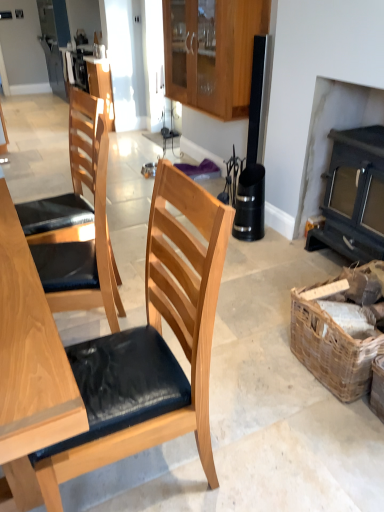
You are a GUI agent. You are given a task and a screenshot of the screen. Output one action in this format:
    pyautogui.click(x=<x>, y=<y>)
    Task: Click on the vacant space in wooden chair with cushion at center, the 2th chair viewed from the top (from a real-world perspective)
    Image resolution: width=384 pixels, height=512 pixels.
    Given the screenshot: What is the action you would take?
    pyautogui.click(x=129, y=481)